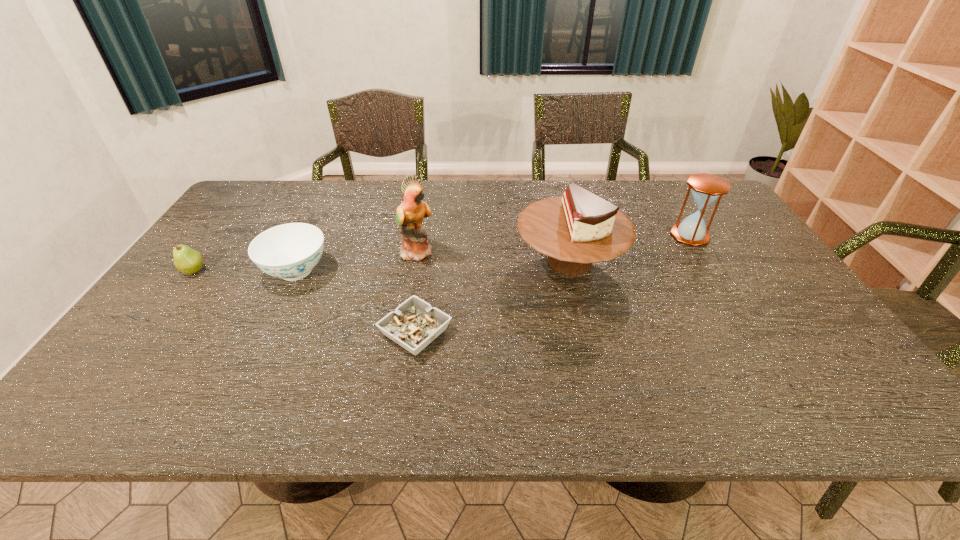
I want to click on parrot, so click(410, 213).

Identify the location of cake. (577, 229).

This screenshot has width=960, height=540. I want to click on hourglass, so click(706, 188).

This screenshot has width=960, height=540. Find the location of `the second object from left to right`. the second object from left to right is located at coordinates (290, 251).

Image resolution: width=960 pixels, height=540 pixels. What are the coordinates of `pear` in the screenshot? It's located at (188, 261).

Identify the location of the nearest object. (414, 324).

The height and width of the screenshot is (540, 960). What are the coordinates of `the shortest object` in the screenshot? It's located at (414, 324).

Find the location of `vacant space located 0.220m on the front-facing side of the tallest object`. vacant space located 0.220m on the front-facing side of the tallest object is located at coordinates (510, 252).

This screenshot has height=540, width=960. Find the location of `vacant space located on the right of the cake`. vacant space located on the right of the cake is located at coordinates (736, 261).

Locate an element on the screen. vacant space situated on the back of the rightmost object is located at coordinates (674, 210).